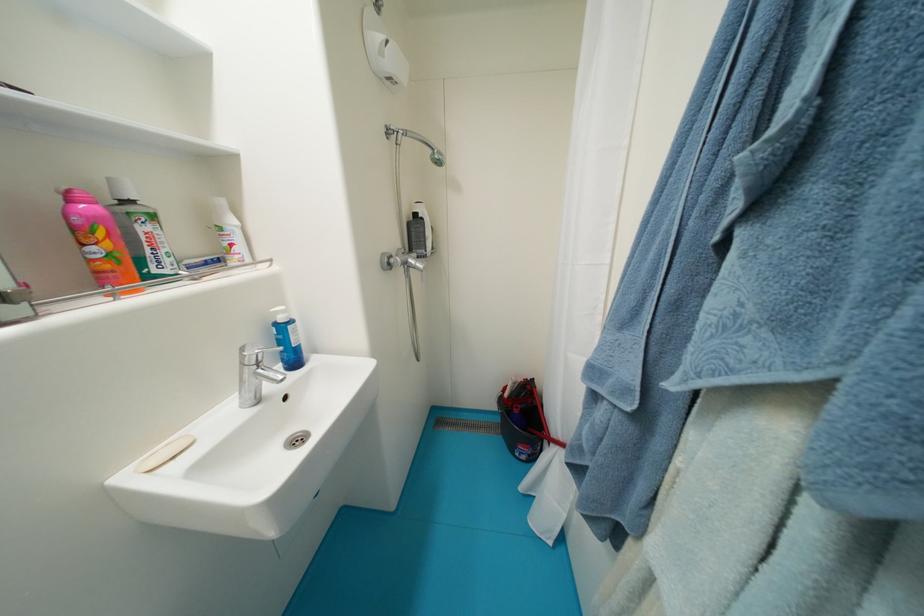
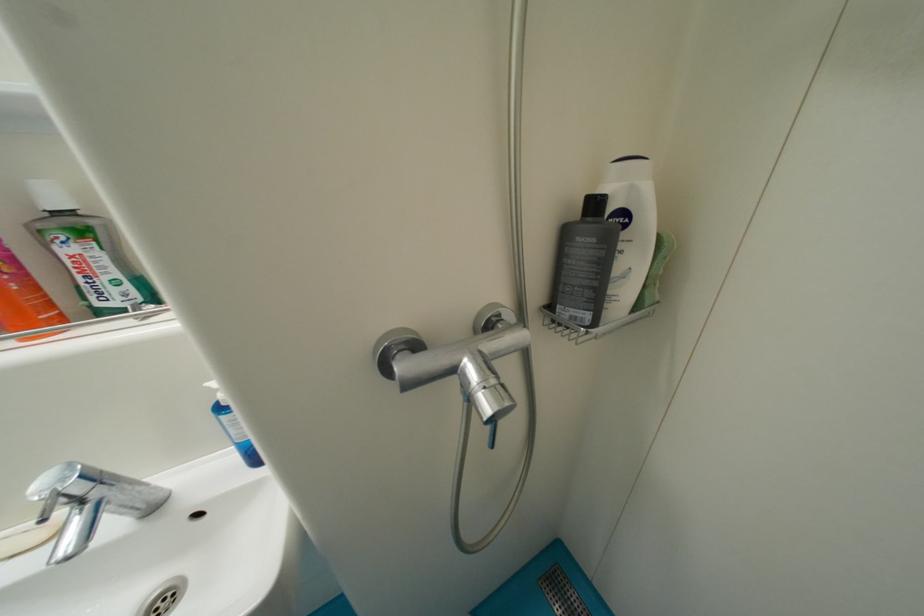
Question: The images are taken continuously from a first-person perspective. In which direction is your viewpoint rotating?

Choices:
 (A) Left
 (B) Right
 (C) Up
 (D) Down

Answer: (A)